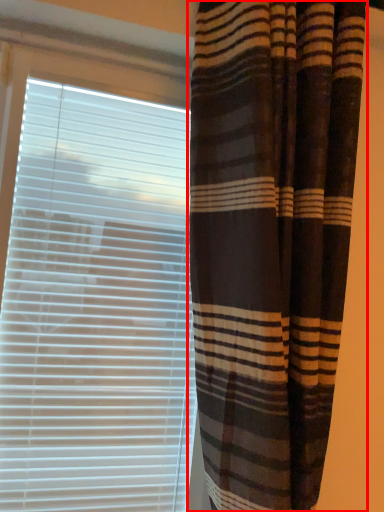
Question: Observing the image, what is the correct spatial positioning of curtain (annotated by the red box) in reference to window blind?

Choices:
 (A) right
 (B) left

Answer: (A)